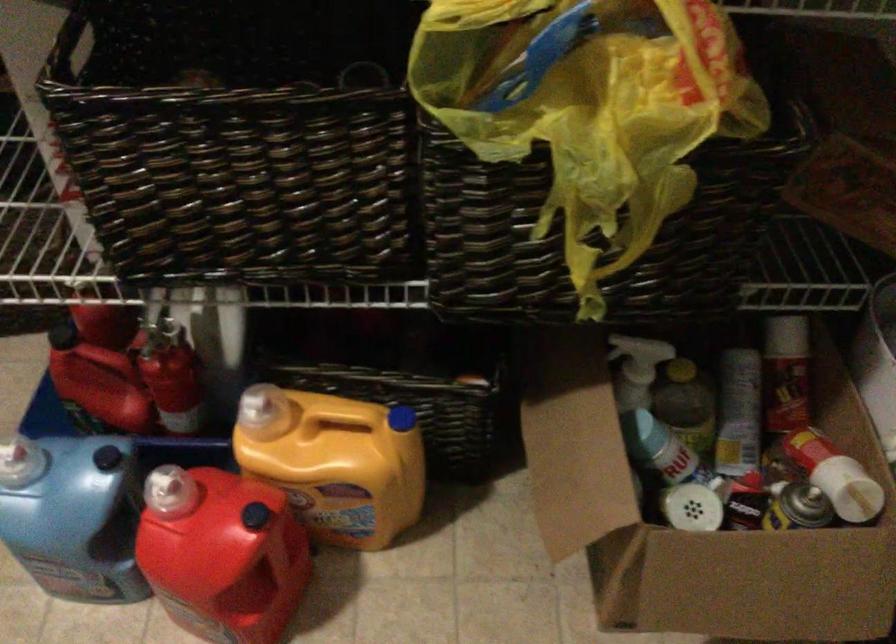
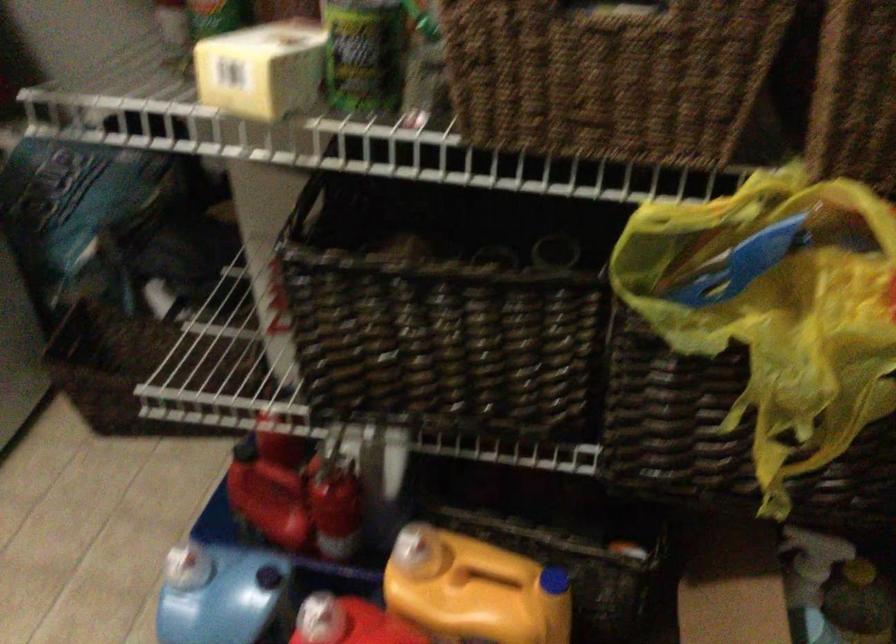
Where in the second image is the point corresponding to point (174, 489) from the first image?

(320, 619)